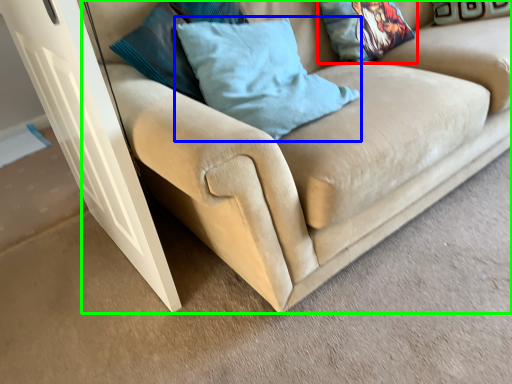
Question: Which object is positioned farthest from pillow (highlighted by a red box)? Select from pillow (highlighted by a blue box) and studio couch (highlighted by a green box).

Choices:
 (A) pillow
 (B) studio couch

Answer: (A)